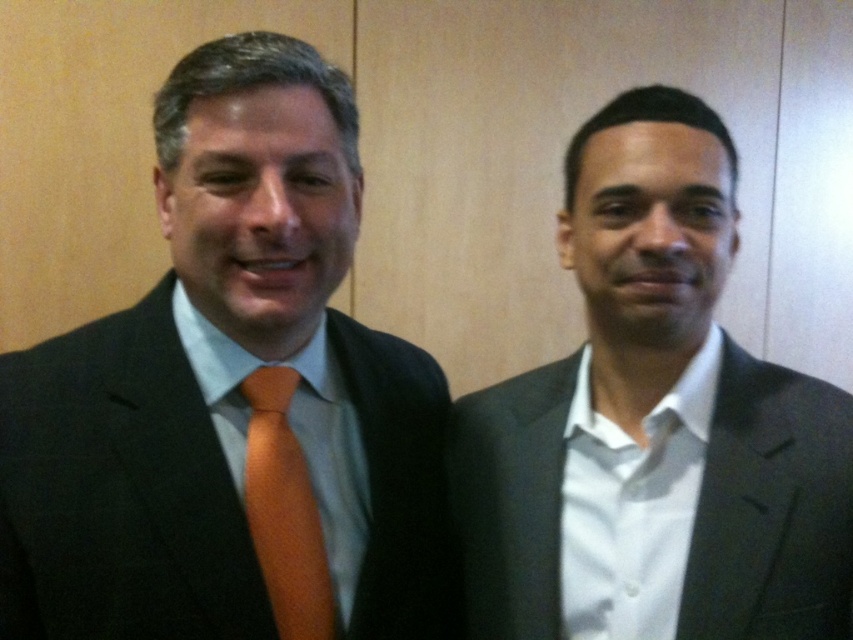
Question: Which of the following is the closest to the observer?

Choices:
 (A) matte black suit at left
 (B) orange satin tie at left
 (C) matte black suit at right

Answer: (A)

Question: Among these points, which one is nearest to the camera?

Choices:
 (A) (288, 531)
 (B) (456, 429)
 (C) (15, 499)

Answer: (C)

Question: Can you confirm if matte black suit at left is smaller than matte black suit at right?

Choices:
 (A) no
 (B) yes

Answer: (A)

Question: Is matte black suit at right thinner than orange satin tie at left?

Choices:
 (A) yes
 (B) no

Answer: (B)

Question: Is matte black suit at left below matte black suit at right?

Choices:
 (A) yes
 (B) no

Answer: (A)

Question: Estimate the real-world distances between objects in this image. Which object is closer to the orange satin tie at left?

Choices:
 (A) matte black suit at left
 (B) matte black suit at right

Answer: (A)